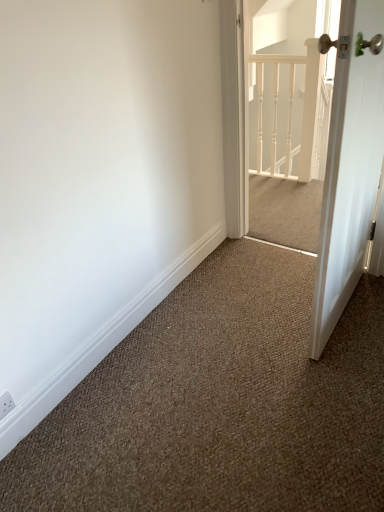
Question: Considering the relative sizes of white glossy door at right and white painted wood railing at upper center in the image provided, is white glossy door at right taller than white painted wood railing at upper center?

Choices:
 (A) no
 (B) yes

Answer: (B)

Question: Is white glossy door at right wider than white painted wood railing at upper center?

Choices:
 (A) yes
 (B) no

Answer: (A)

Question: From a real-world perspective, is white glossy door at right on top of white painted wood railing at upper center?

Choices:
 (A) no
 (B) yes

Answer: (B)

Question: Does white glossy door at right have a larger size compared to white painted wood railing at upper center?

Choices:
 (A) no
 (B) yes

Answer: (B)

Question: Is white glossy door at right facing towards white painted wood railing at upper center?

Choices:
 (A) no
 (B) yes

Answer: (A)

Question: From the image's perspective, is white glossy door at right over white painted wood railing at upper center?

Choices:
 (A) no
 (B) yes

Answer: (A)

Question: Can you confirm if white textured screen door at upper right is thinner than white painted wood railing at upper center?

Choices:
 (A) no
 (B) yes

Answer: (A)

Question: Is white textured screen door at upper right placed right next to white painted wood railing at upper center?

Choices:
 (A) no
 (B) yes

Answer: (A)

Question: From the image's perspective, is white textured screen door at upper right on top of white painted wood railing at upper center?

Choices:
 (A) no
 (B) yes

Answer: (A)

Question: From the image's perspective, is white textured screen door at upper right located beneath white painted wood railing at upper center?

Choices:
 (A) yes
 (B) no

Answer: (A)

Question: Is white textured screen door at upper right bigger than white painted wood railing at upper center?

Choices:
 (A) no
 (B) yes

Answer: (B)

Question: Is white textured screen door at upper right closer to the viewer compared to white painted wood railing at upper center?

Choices:
 (A) no
 (B) yes

Answer: (B)

Question: Is white painted wood railing at upper center looking in the opposite direction of white glossy door at right?

Choices:
 (A) yes
 (B) no

Answer: (B)